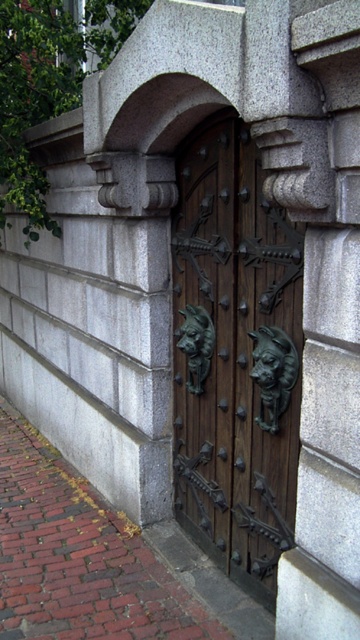
You are standing in front of a building with a large ornate wooden door. There are two lion head handles on the door. If you were to place a small decorative plaque exactly at the point marked by coordinates point (235, 356), where would it be positioned relative to the wooden door with metal accents?

The point (235, 356) is at the center of the wooden door with metal accents, so placing a plaque there would position it directly in the middle of the door.

You are a delivery person trying to unload a package that requires a platform at least 2 meters tall. You see the wooden door with metal accents at center and the brick pavement at lower left. Which object can you use as a platform for the package?

The wooden door with metal accents at center is taller than the brick pavement at lower left. Since the door is taller, it might be suitable as a platform for the package if it meets the required height of 2 meters. However, the actual height isn